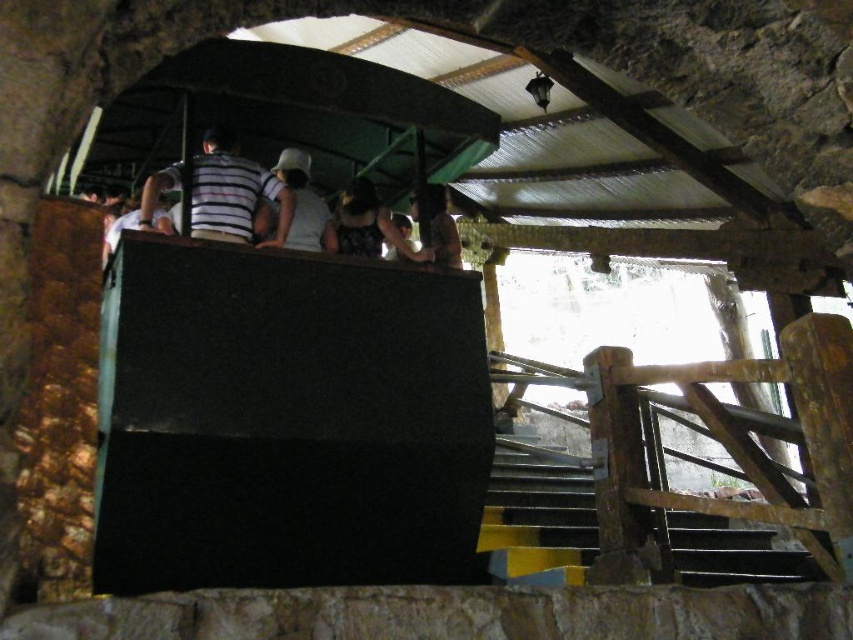
You are standing at the base of the platform and want to hand a white matte hat at upper center to a friend who is 4.54 meters away. Can you throw it directly without it hitting the corrugated metal roof?

The white matte hat at upper center is 4.54 meters away. Since the corrugated metal roof is overhead, you need to consider the height of the throw. If the throwing arc is lower than the roof, it might be possible. However, without knowing the roof height or the throwing angle, it is uncertain. But given the distance is 4.54 meters, it might be challenging to throw accurately without obstacles. However, the question specifies not to assume beyond given data. Since the description only mentions distance, not

You are standing at the entrance of the cave and want to take a photo of the metallic gray stairs at lower right and the striped fabric shirt at upper center. Which object should you focus on first if you want to capture both in the same frame without moving the camera?

You should focus on the metallic gray stairs at lower right first because it is closer to you than the striped fabric shirt at upper center, allowing both to be in the same frame without moving the camera.

You are standing in the cave and want to touch both the point at coordinates (218, 186) and the point at coordinates (453, 241). Which point will require you to reach further out?

The point at coordinates (453, 241) will require you to reach further out because it is farther from the viewer compared to the point at (218, 186).